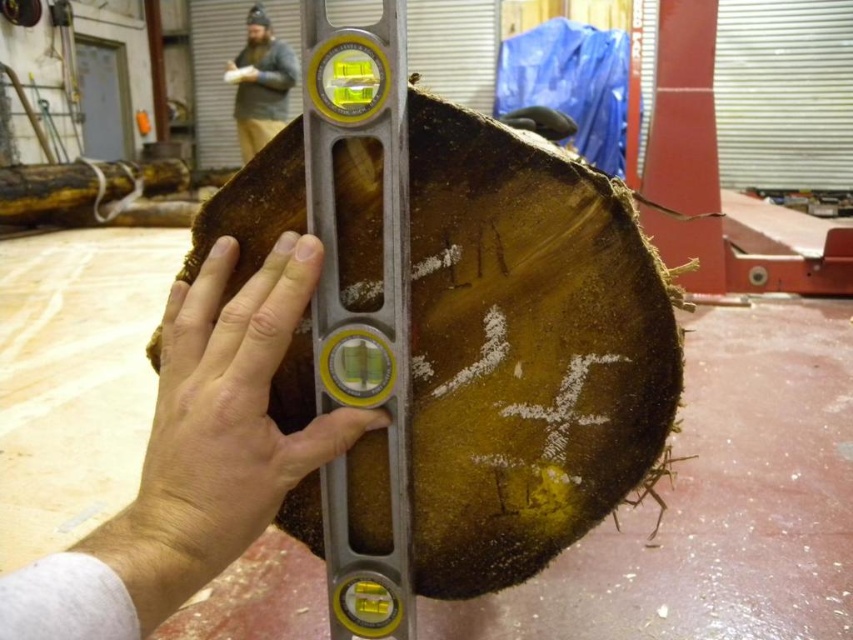
Question: Which point is farther to the camera?

Choices:
 (A) (254, 134)
 (B) (236, 448)

Answer: (A)

Question: Does brown rough wood at center come in front of bearded man at upper left?

Choices:
 (A) yes
 (B) no

Answer: (A)

Question: From the image, what is the correct spatial relationship of brown rough wood at center in relation to bearded man at upper left?

Choices:
 (A) right
 (B) left

Answer: (A)

Question: Is brown rough wood at center thinner than bearded man at upper left?

Choices:
 (A) yes
 (B) no

Answer: (A)